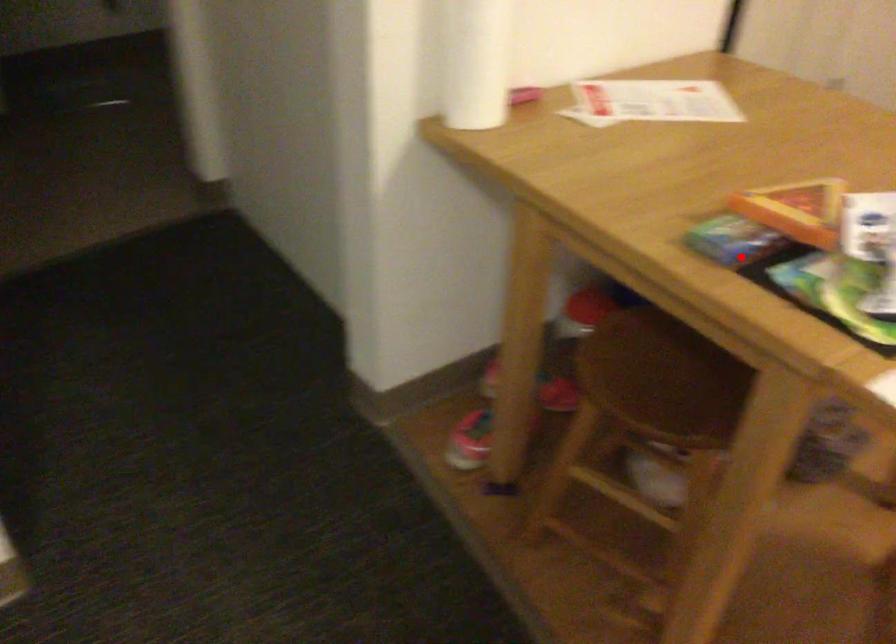
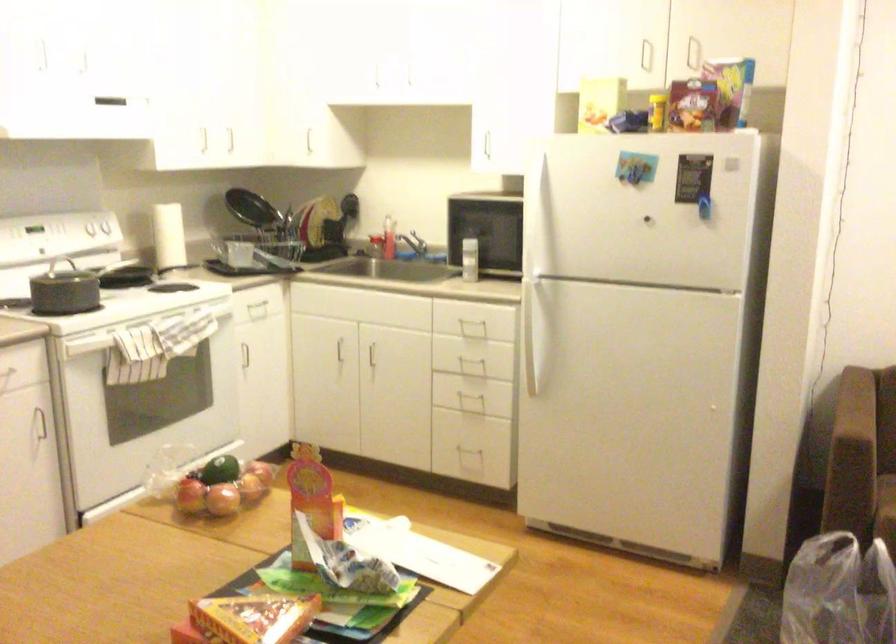
Question: I am providing you with two images of the same scene from different viewpoints. Image1 has a red point marked. In image2, the corresponding 3D location appears at what relative position? Reply with the corresponding letter.

Choices:
 (A) Closer
 (B) Farther

Answer: (B)